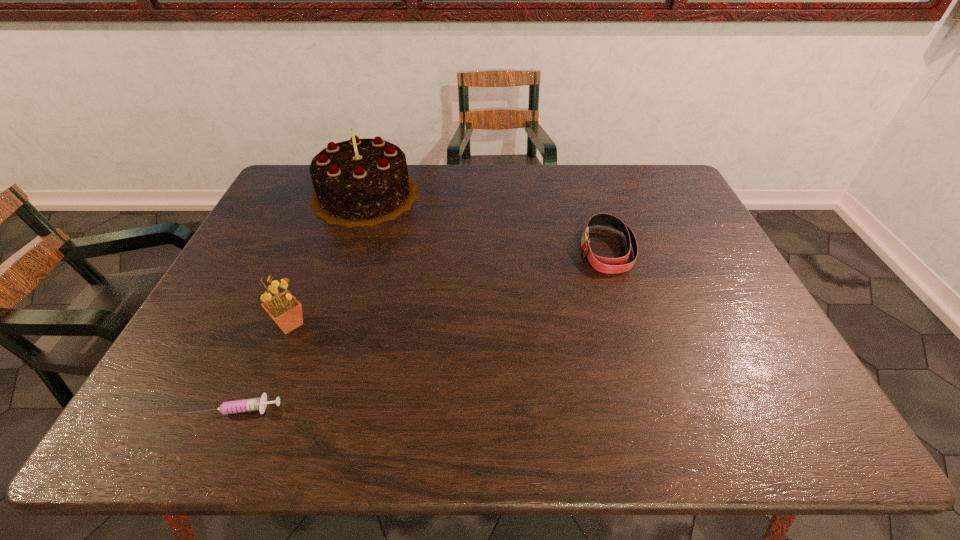
Locate an element on the screen. birthday cake is located at coordinates (360, 182).

Image resolution: width=960 pixels, height=540 pixels. I want to click on the third farthest object, so point(286,311).

Identify the location of sunflower. (286, 311).

You are a GUI agent. You are given a task and a screenshot of the screen. Output one action in this format:
    pyautogui.click(x=<x>, y=<y>)
    Task: Click on the third tallest object
    
    Given the screenshot: What is the action you would take?
    pyautogui.click(x=605, y=265)

Where is `dog collar`? The image size is (960, 540). dog collar is located at coordinates (605, 265).

Image resolution: width=960 pixels, height=540 pixels. Identify the location of the shortest object. pyautogui.click(x=253, y=404).

Find the location of `the nearest object`. the nearest object is located at coordinates (253, 404).

What are the coordinates of `vacant space located on the left of the birthday cake` in the screenshot? It's located at (276, 195).

You are a GUI agent. You are given a task and a screenshot of the screen. Output one action in this format:
    pyautogui.click(x=<x>, y=<y>)
    Task: Click on the free region located 0.350m at the front of the sunflower with flowers visible
    This screenshot has height=540, width=960.
    Given the screenshot: What is the action you would take?
    pyautogui.click(x=454, y=324)

The image size is (960, 540). Find the location of `free spot located on the back of the dog collar`. free spot located on the back of the dog collar is located at coordinates (594, 210).